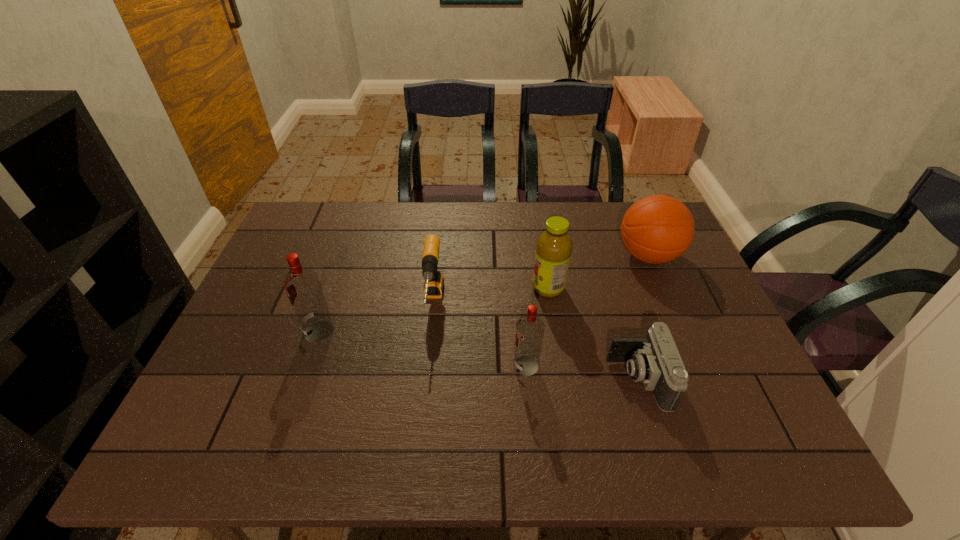
Locate an element on the screen. The height and width of the screenshot is (540, 960). vacant point at the right edge is located at coordinates (690, 297).

Identify the location of vacant region at the far left corner of the desktop. The image size is (960, 540). (293, 215).

This screenshot has height=540, width=960. I want to click on vacant region at the near right corner of the desktop, so pyautogui.click(x=762, y=398).

This screenshot has height=540, width=960. Find the location of `vacant space that's between the left vodka and the shortest object`. vacant space that's between the left vodka and the shortest object is located at coordinates (479, 355).

You are a GUI agent. You are given a task and a screenshot of the screen. Output one action in this format:
    pyautogui.click(x=<x>, y=<y>)
    Task: Click on the free spot between the taller vodka and the shortest object
    Image resolution: width=960 pixels, height=540 pixels.
    Given the screenshot: What is the action you would take?
    pyautogui.click(x=479, y=355)

Find the location of a particular element. empty space that is in between the left vodka and the nearer vodka is located at coordinates (422, 348).

Find the location of a particular element. This screenshot has height=540, width=960. blank region between the fruit juice and the basketball is located at coordinates tap(598, 272).

You are a GUI agent. You are given a task and a screenshot of the screen. Output one action in this format:
    pyautogui.click(x=<x>, y=<y>)
    Task: Click on the vacant space that's between the fifth object from right to left and the shorter vodka
    Image resolution: width=960 pixels, height=540 pixels.
    Given the screenshot: What is the action you would take?
    pyautogui.click(x=479, y=334)

Find the location of a particular element. empty space between the shorter vodka and the shortest object is located at coordinates (582, 373).

What are the coordinates of `unoccupied position between the nearer vodka and the drill` in the screenshot? It's located at coord(479,334).